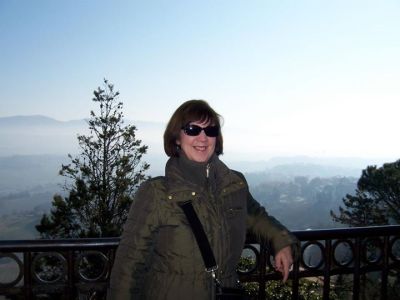
Locate an element on the screen. The height and width of the screenshot is (300, 400). handrail is located at coordinates (69, 245), (343, 232).